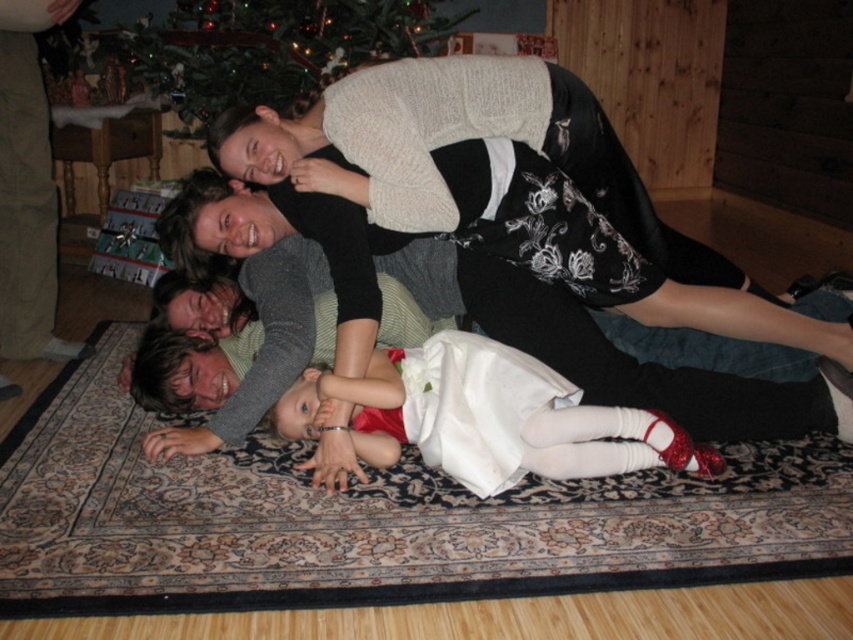
Question: Is black floral dress at upper center to the left of green matte christmas tree at upper center from the viewer's perspective?

Choices:
 (A) yes
 (B) no

Answer: (B)

Question: Can you confirm if white satin dress at center is smaller than green matte christmas tree at upper center?

Choices:
 (A) yes
 (B) no

Answer: (A)

Question: Which object is positioned farthest from the green matte christmas tree at upper center?

Choices:
 (A) white satin dress at center
 (B) black floral dress at upper center

Answer: (A)

Question: Which point is farther to the camera?

Choices:
 (A) black floral dress at upper center
 (B) green matte christmas tree at upper center

Answer: (B)

Question: Which is farther from the white satin dress at center?

Choices:
 (A) black floral dress at upper center
 (B) green matte christmas tree at upper center

Answer: (B)

Question: Does black floral dress at upper center appear under white satin dress at center?

Choices:
 (A) yes
 (B) no

Answer: (B)